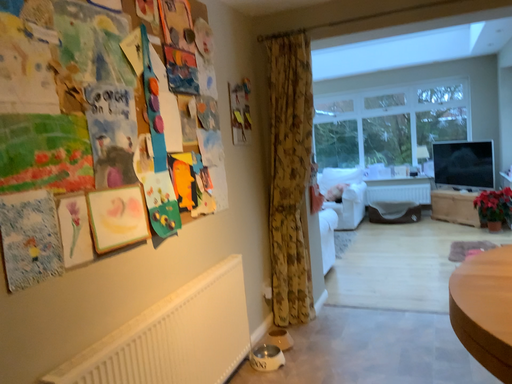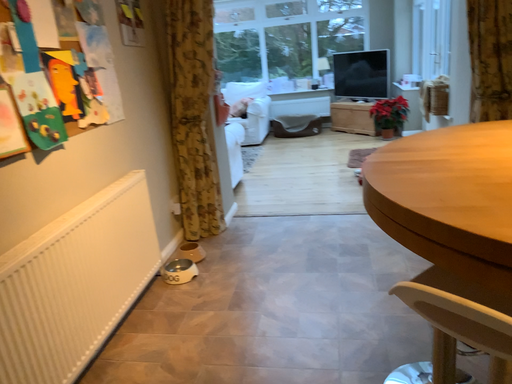
Question: Which way did the camera rotate in the video?

Choices:
 (A) rotated left
 (B) rotated right

Answer: (B)